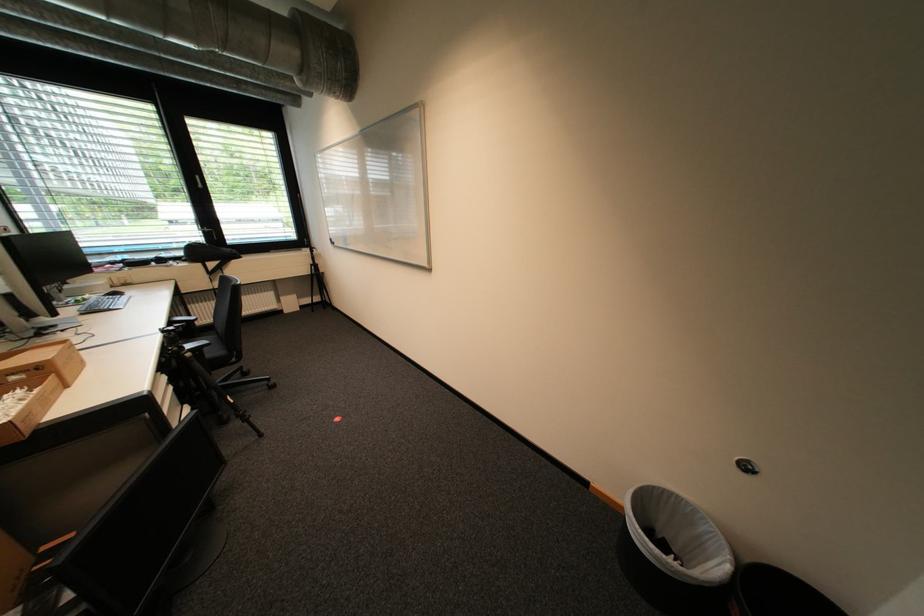
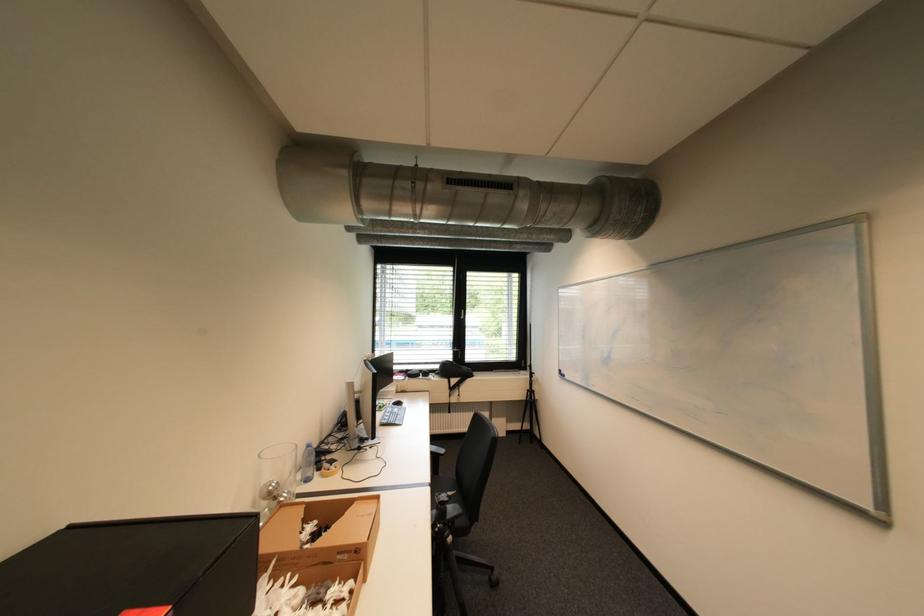
Where in the second image is the point corresponding to point (94, 297) from the first image?

(393, 403)